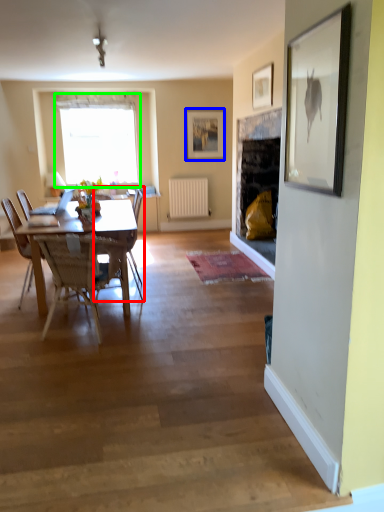
Question: Estimate the real-world distances between objects in this image. Which object is closer to chair (highlighted by a red box), picture frame (highlighted by a blue box) or window (highlighted by a green box)?

Choices:
 (A) picture frame
 (B) window

Answer: (B)